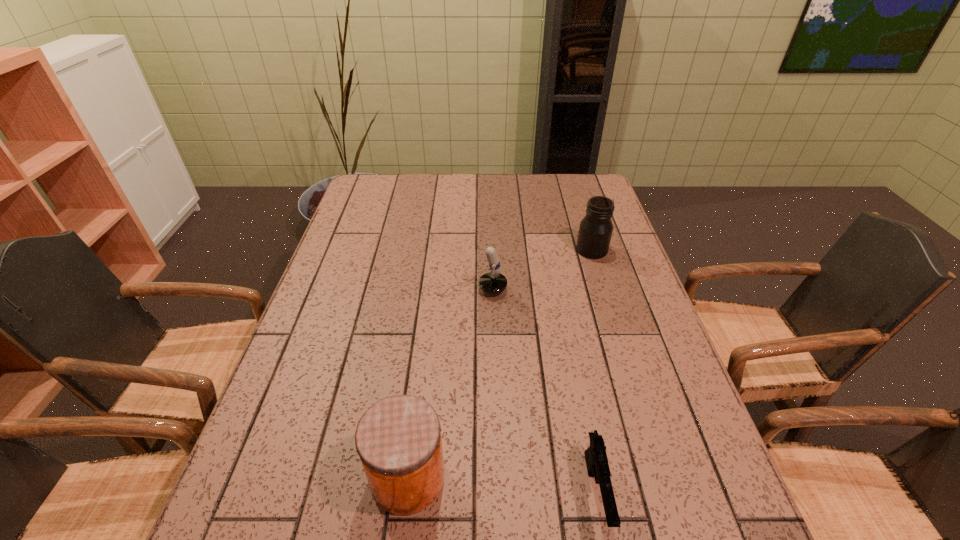
This screenshot has width=960, height=540. I want to click on free space at the left edge of the desktop, so click(x=291, y=379).

This screenshot has height=540, width=960. In the image, there is a desktop. Find the location of `vacant space at the right edge`. vacant space at the right edge is located at coordinates (734, 519).

Locate an element on the screen. vacant position at the far left corner of the desktop is located at coordinates (395, 185).

The image size is (960, 540). In order to click on free spot at the far right corner of the desktop in this screenshot , I will do `click(569, 192)`.

Locate an element on the screen. This screenshot has width=960, height=540. vacant point located between the third tallest object and the left jar is located at coordinates (441, 383).

Where is `unoccupied position between the second shortest object and the nearer jar`? unoccupied position between the second shortest object and the nearer jar is located at coordinates (441, 383).

Image resolution: width=960 pixels, height=540 pixels. Identify the location of free point between the nearer jar and the farthest object. (500, 363).

Locate an element on the screen. This screenshot has height=540, width=960. vacant area that lies between the left jar and the rightmost object is located at coordinates (500, 363).

Where is `unoccupied area between the nearer jar and the third nearest object`? unoccupied area between the nearer jar and the third nearest object is located at coordinates (441, 383).

Locate an element on the screen. The width and height of the screenshot is (960, 540). vacant region between the rightmost object and the second shortest object is located at coordinates (532, 269).